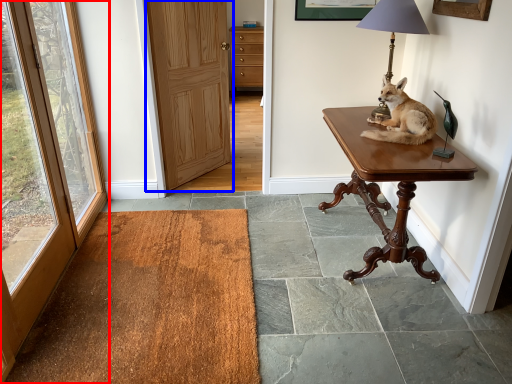
Question: Which object is further to the camera taking this photo, door (highlighted by a red box) or door (highlighted by a blue box)?

Choices:
 (A) door
 (B) door

Answer: (B)